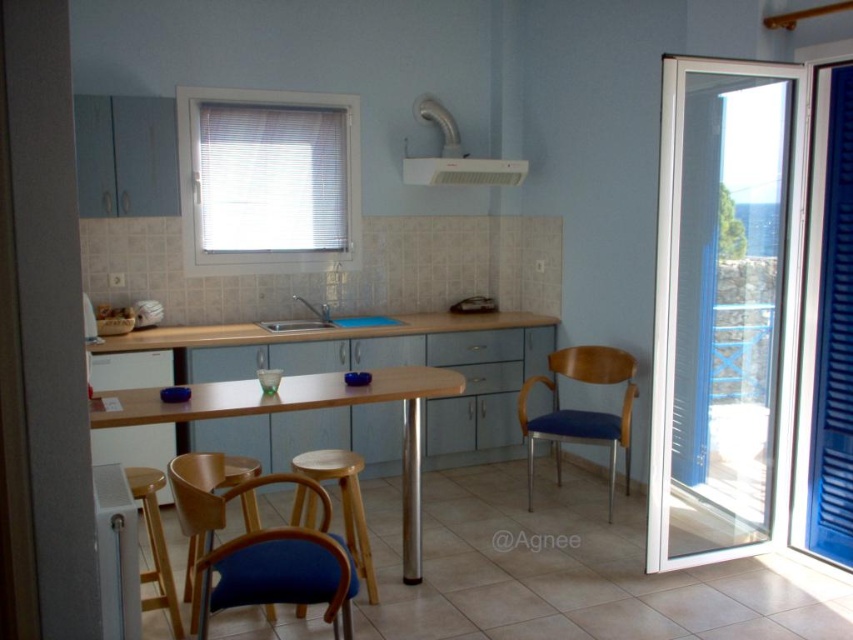
Between blue fabric chair at lower center and matte stainless steel sink at center, which one appears on the right side from the viewer's perspective?

Positioned to the right is blue fabric chair at lower center.

Who is more forward, (347,595) or (321,321)?

Positioned in front is point (347,595).

Locate an element on the screen. This screenshot has height=640, width=853. blue fabric chair at lower center is located at coordinates (260, 548).

Between blue fabric chair at lower center and blue fabric chair at center, which one has less height?

Standing shorter between the two is blue fabric chair at lower center.

Is point (192, 518) positioned behind point (531, 488)?

No, it is in front of (531, 488).

This screenshot has height=640, width=853. What are the coordinates of `blue fabric chair at lower center` in the screenshot? It's located at (260, 548).

Between transparent glass door at right and blue fabric chair at center, which one appears on the right side from the viewer's perspective?

Positioned to the right is transparent glass door at right.

Identify the location of transparent glass door at right. (723, 307).

At what (x,y) coordinates should I click in order to perform the action: click on transparent glass door at right. Please return your answer as a coordinate pair (x, y). Looking at the image, I should click on (723, 307).